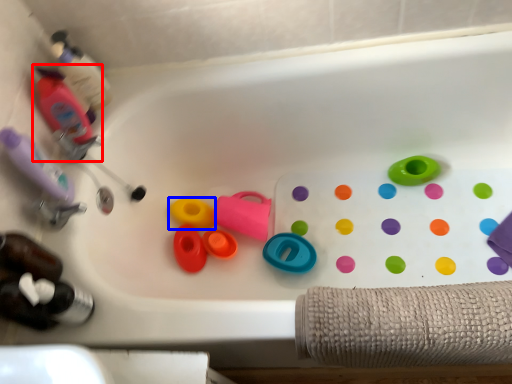
Question: Among these objects, which one is nearest to the camera, bottle (highlighted by a red box) or toy (highlighted by a blue box)?

Choices:
 (A) bottle
 (B) toy

Answer: (A)